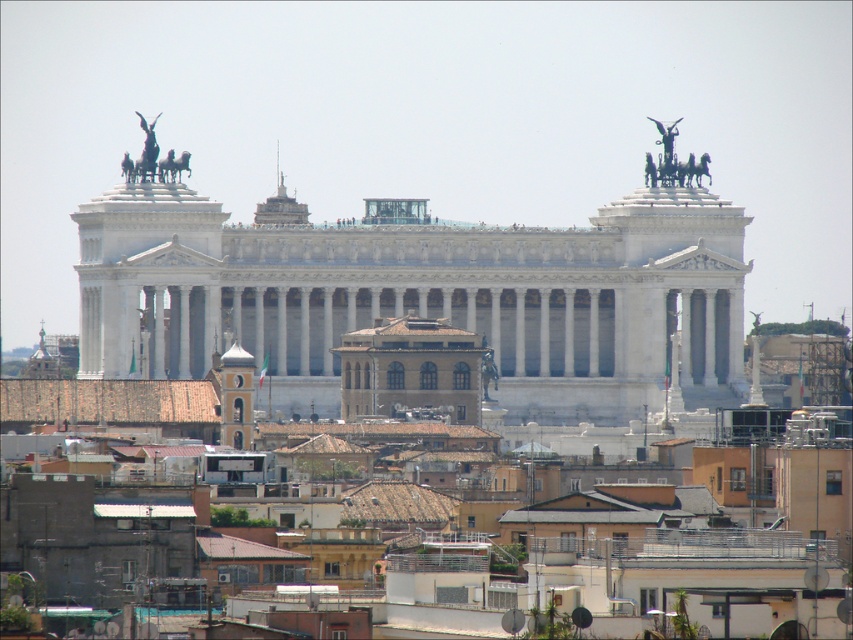
You are an architect examining the grand neoclassical building and notice two sculptures at the upper left corner. Which one is bigger between the polished bronze chariot at upper left and the polished bronze horse at upper left?

The polished bronze chariot at upper left is larger in size than the polished bronze horse at upper left.

You are standing in the urban landscape in front of the grand neoclassical building. You see a point marked at coordinates (236, 397). What does this point indicate?

The point at coordinates (236, 397) corresponds to the smooth gray tower at center.